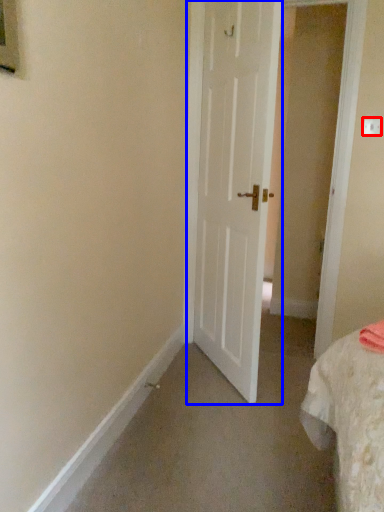
Question: Which of the following is the farthest to the observer, electric outlet (highlighted by a red box) or door (highlighted by a blue box)?

Choices:
 (A) electric outlet
 (B) door

Answer: (A)